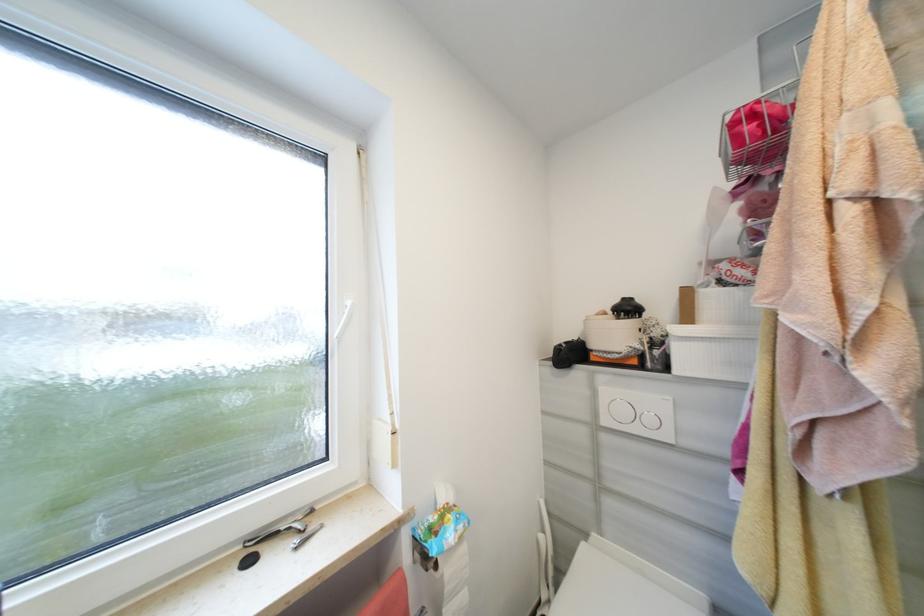
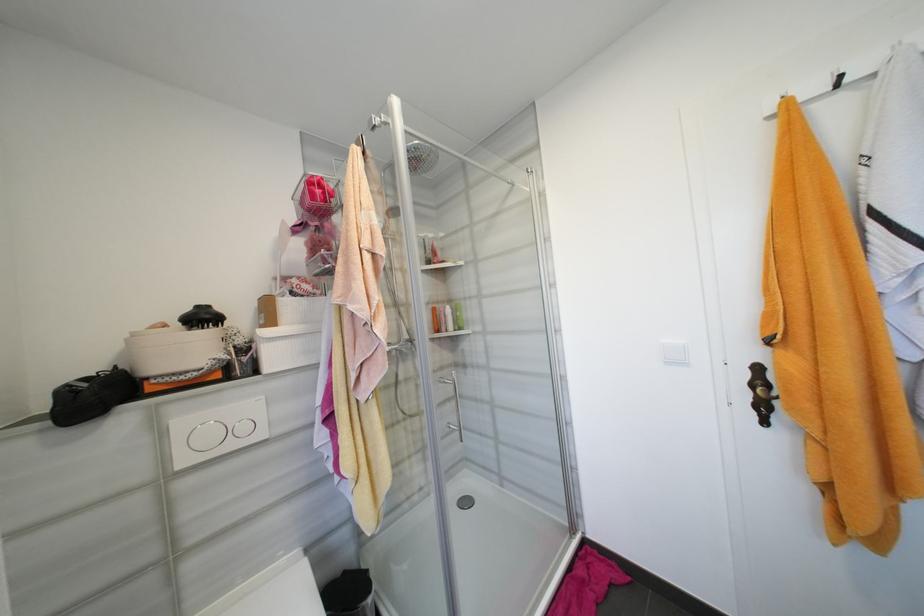
Find the pixel in the second image that matches [592,318] in the first image.

(140, 334)